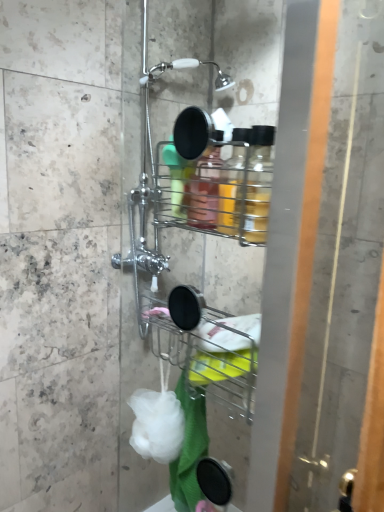
What do you see at coordinates (189, 451) in the screenshot? The height and width of the screenshot is (512, 384). I see `white soft bath towel at lower center` at bounding box center [189, 451].

This screenshot has height=512, width=384. I want to click on white matte sponge at lower center, so click(157, 425).

Locate an element on the screen. The width and height of the screenshot is (384, 512). transparent glass screen door at right is located at coordinates (343, 266).

From the image's perspective, which object appears higher, white soft bath towel at lower center or white matte sponge at lower center?

From the image's view, white matte sponge at lower center is above.

From a real-world perspective, which is physically above, white soft bath towel at lower center or white matte sponge at lower center?

white matte sponge at lower center.

Visually, is white soft bath towel at lower center positioned to the left or to the right of white matte sponge at lower center?

white soft bath towel at lower center is positioned on white matte sponge at lower center's right side.

From a real-world perspective, is transparent glass screen door at right physically located above or below white soft bath towel at lower center?

transparent glass screen door at right is above white soft bath towel at lower center.

Between transparent glass screen door at right and white soft bath towel at lower center, which one has less height?

white soft bath towel at lower center.

Considering their positions, is transparent glass screen door at right located in front of or behind white soft bath towel at lower center?

Clearly, transparent glass screen door at right is in front of white soft bath towel at lower center.

Choose the correct answer: Is white matte sponge at lower center inside transparent glass screen door at right or outside it?

white matte sponge at lower center is not enclosed by transparent glass screen door at right.

Would you consider white matte sponge at lower center to be distant from transparent glass screen door at right?

They are positioned close to each other.

Considering the positions of objects white matte sponge at lower center and transparent glass screen door at right in the image provided, who is behind, white matte sponge at lower center or transparent glass screen door at right?

Positioned behind is white matte sponge at lower center.

Identify the location of screen door in front of the white matte sponge at lower center. The width and height of the screenshot is (384, 512). (343, 266).

Is white soft bath towel at lower center at the right side of transparent glass screen door at right?

In fact, white soft bath towel at lower center is to the left of transparent glass screen door at right.

Is white soft bath towel at lower center shorter than transparent glass screen door at right?

Indeed, white soft bath towel at lower center has a lesser height compared to transparent glass screen door at right.

Is white soft bath towel at lower center smaller than transparent glass screen door at right?

Yes, white soft bath towel at lower center is smaller than transparent glass screen door at right.

Is white matte sponge at lower center far away from white soft bath towel at lower center?

No, white matte sponge at lower center is not far from white soft bath towel at lower center.

Image resolution: width=384 pixels, height=512 pixels. Identify the location of plastic on the left side of white soft bath towel at lower center. (157, 425).

Between point (146, 390) and point (176, 472), which one is positioned in front?

Positioned in front is point (176, 472).

Which object is positioned more to the left, white matte sponge at lower center or white soft bath towel at lower center?

From the viewer's perspective, white matte sponge at lower center appears more on the left side.

Can you confirm if transparent glass screen door at right is smaller than white matte sponge at lower center?

Incorrect, transparent glass screen door at right is not smaller in size than white matte sponge at lower center.

Considering the positions of objects transparent glass screen door at right and white matte sponge at lower center in the image provided, who is more to the left, transparent glass screen door at right or white matte sponge at lower center?

Positioned to the left is white matte sponge at lower center.

Choose the correct answer: Is transparent glass screen door at right inside white matte sponge at lower center or outside it?

transparent glass screen door at right exists outside the volume of white matte sponge at lower center.

Locate an element on the screen. bath towel that appears on the right of white matte sponge at lower center is located at coordinates (189, 451).

At what (x,y) coordinates should I click in order to perform the action: click on bath towel that is below the transparent glass screen door at right (from the image's perspective). Please return your answer as a coordinate pair (x, y). The height and width of the screenshot is (512, 384). Looking at the image, I should click on (189, 451).

Looking at the image, which one is located closer to white soft bath towel at lower center, transparent glass screen door at right or white matte sponge at lower center?

Based on the image, white matte sponge at lower center appears to be nearer to white soft bath towel at lower center.

From the image, which object appears to be farther from white matte sponge at lower center, transparent glass screen door at right or white soft bath towel at lower center?

Based on the image, transparent glass screen door at right appears to be further to white matte sponge at lower center.

From the picture: Which object lies nearer to the anchor point white matte sponge at lower center, white soft bath towel at lower center or transparent glass screen door at right?

Based on the image, white soft bath towel at lower center appears to be nearer to white matte sponge at lower center.

Consider the image. From the image, which object appears to be nearer to transparent glass screen door at right, white soft bath towel at lower center or white matte sponge at lower center?

white soft bath towel at lower center lies closer to transparent glass screen door at right than the other object.

Considering their positions, is white matte sponge at lower center positioned closer to transparent glass screen door at right than white soft bath towel at lower center?

Based on the image, white soft bath towel at lower center appears to be nearer to transparent glass screen door at right.

Which object lies further to the anchor point white soft bath towel at lower center, white matte sponge at lower center or transparent glass screen door at right?

transparent glass screen door at right is further to white soft bath towel at lower center.

Locate an element on the screen. The image size is (384, 512). plastic between transparent glass screen door at right and white soft bath towel at lower center in the front-back direction is located at coordinates (157, 425).